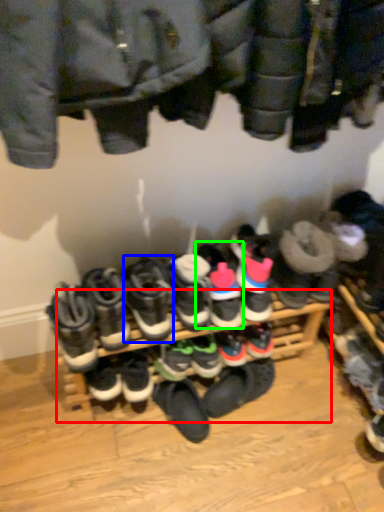
Question: Based on their relative distances, which object is farther from shelf (highlighted by a red box)? Choose from footwear (highlighted by a blue box) and footwear (highlighted by a green box).

Choices:
 (A) footwear
 (B) footwear

Answer: (B)